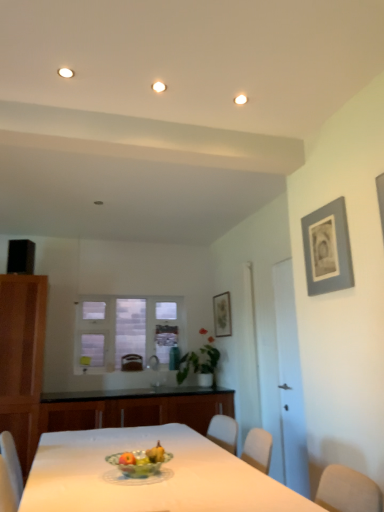
Question: From a real-world perspective, is white glass window at center located higher than matte gray picture frame at upper center, acting as the second picture frame starting from the front?

Choices:
 (A) no
 (B) yes

Answer: (A)

Question: Is matte gray picture frame at upper center, which appears as the 1th picture frame when ordered from the bottom, completely or partially inside white glass window at center?

Choices:
 (A) no
 (B) yes

Answer: (A)

Question: Can you confirm if white glass window at center is shorter than matte gray picture frame at upper center, which ranks as the 2th picture frame in top-to-bottom order?

Choices:
 (A) no
 (B) yes

Answer: (A)

Question: From the image's perspective, is white glass window at center located beneath matte gray picture frame at upper center, acting as the second picture frame starting from the front?

Choices:
 (A) yes
 (B) no

Answer: (A)

Question: Is white glass window at center taller than matte gray picture frame at upper center, the 2th picture frame when ordered from right to left?

Choices:
 (A) no
 (B) yes

Answer: (B)

Question: In the image, is brown leather armchair at center on the left side or the right side of matte gray picture frame at upper center, acting as the first picture frame starting from the left?

Choices:
 (A) left
 (B) right

Answer: (A)

Question: Is brown leather armchair at center wider or thinner than matte gray picture frame at upper center, which ranks as the 2th picture frame in top-to-bottom order?

Choices:
 (A) wide
 (B) thin

Answer: (A)

Question: Considering the positions of point (132, 354) and point (213, 311), is point (132, 354) closer or farther from the camera than point (213, 311)?

Choices:
 (A) closer
 (B) farther

Answer: (A)

Question: From a real-world perspective, relative to matte gray picture frame at upper center, which appears as the 1th picture frame when ordered from the bottom, is brown leather armchair at center vertically above or below?

Choices:
 (A) below
 (B) above

Answer: (A)

Question: Is green glass bowl at center in front of or behind matte gray picture frame at upper center, which appears as the 1th picture frame when ordered from the bottom, in the image?

Choices:
 (A) behind
 (B) front

Answer: (B)

Question: Considering the positions of green glass bowl at center and matte gray picture frame at upper center, which appears as the 1th picture frame when ordered from the bottom, in the image, is green glass bowl at center wider or thinner than matte gray picture frame at upper center, which appears as the 1th picture frame when ordered from the bottom,?

Choices:
 (A) wide
 (B) thin

Answer: (A)

Question: Is green glass bowl at center bigger or smaller than matte gray picture frame at upper center, the 1th picture frame when ordered from back to front?

Choices:
 (A) small
 (B) big

Answer: (A)

Question: From the image's perspective, relative to matte gray picture frame at upper center, acting as the second picture frame starting from the front, is green glass bowl at center above or below?

Choices:
 (A) below
 (B) above

Answer: (A)

Question: Is point [x=337, y=246] positioned closer to the camera than point [x=134, y=365]?

Choices:
 (A) farther
 (B) closer

Answer: (B)

Question: In the image, is gray matte picture frame at upper right, the 1th picture frame in the right-to-left sequence, positioned in front of or behind brown leather armchair at center?

Choices:
 (A) front
 (B) behind

Answer: (A)